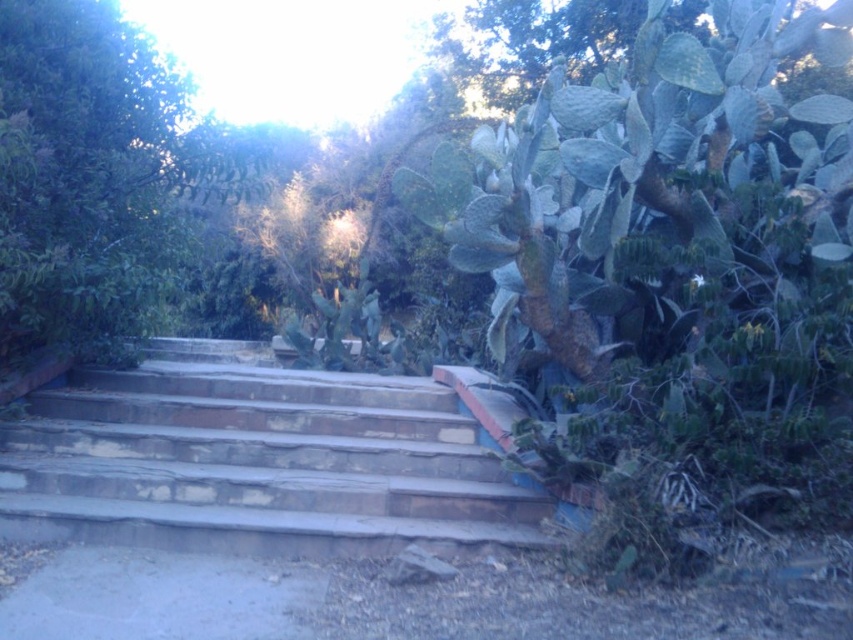
Question: Where is stone stairs at center located in relation to green leafy tree at upper left in the image?

Choices:
 (A) above
 (B) below

Answer: (B)

Question: Which point is closer to the camera?

Choices:
 (A) green leafy tree at upper left
 (B) stone stairs at center

Answer: (A)

Question: Can you confirm if stone stairs at center is wider than green leafy tree at upper left?

Choices:
 (A) no
 (B) yes

Answer: (B)

Question: Which object is closer to the camera taking this photo?

Choices:
 (A) stone stairs at center
 (B) green leafy tree at upper left

Answer: (B)

Question: Is stone stairs at center wider than green leafy tree at upper left?

Choices:
 (A) no
 (B) yes

Answer: (B)

Question: Which point is farther from the camera taking this photo?

Choices:
 (A) (392, 506)
 (B) (138, 68)

Answer: (B)